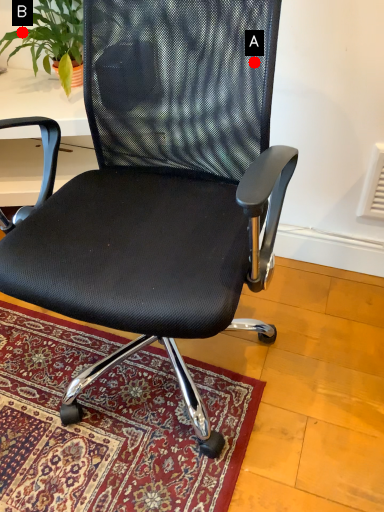
Question: Two points are circled on the image, labeled by A and B beside each circle. Which point appears closest to the camera in this image?

Choices:
 (A) A is closer
 (B) B is closer

Answer: (A)